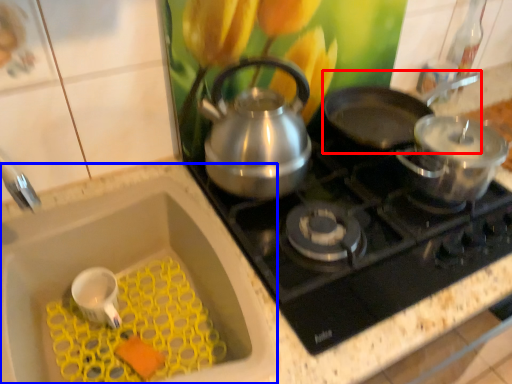
Question: Which object appears farthest to the camera in this image, frying pan (highlighted by a red box) or sink (highlighted by a blue box)?

Choices:
 (A) frying pan
 (B) sink

Answer: (A)